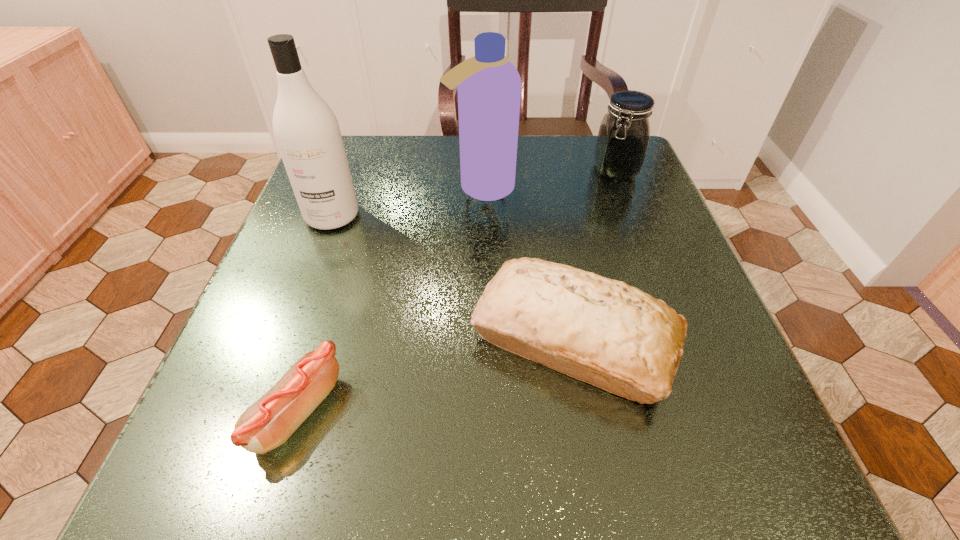
Where is `the left shampoo`? This screenshot has width=960, height=540. the left shampoo is located at coordinates coord(306,130).

Where is `the right shampoo`? The height and width of the screenshot is (540, 960). the right shampoo is located at coordinates (489, 86).

Find the location of a particular element. The image size is (960, 540). the third tallest object is located at coordinates (624, 133).

Find the location of a particular element. The height and width of the screenshot is (540, 960). bread is located at coordinates (614, 336).

Find the location of `sausage`. sausage is located at coordinates [x=268, y=423].

The image size is (960, 540). In order to click on vacant space located 0.170m on the front-facing side of the left shampoo in this screenshot , I will do `click(300, 300)`.

You are a GUI agent. You are given a task and a screenshot of the screen. Output one action in this format:
    pyautogui.click(x=<x>, y=<y>)
    Task: Click on the vacant space located 0.210m on the right of the right shampoo
    
    Given the screenshot: What is the action you would take?
    pyautogui.click(x=612, y=188)

Where is `free location located 0.160m on the lid of the third tallest object`? The height and width of the screenshot is (540, 960). free location located 0.160m on the lid of the third tallest object is located at coordinates (639, 232).

Image resolution: width=960 pixels, height=540 pixels. What are the coordinates of `free space located on the right of the fourth tallest object` in the screenshot? It's located at (715, 338).

Where is `free location located 0.120m on the back of the shortest object`? free location located 0.120m on the back of the shortest object is located at coordinates (331, 302).